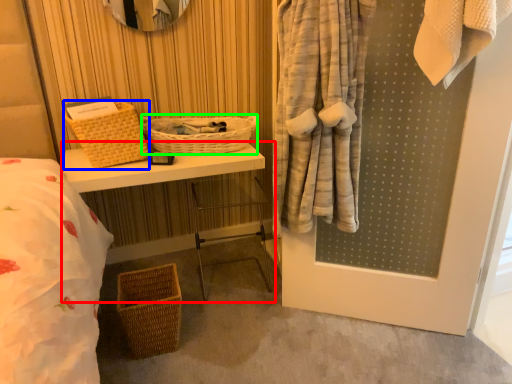
Question: Considering the real-world distances, which object is farthest from table (highlighted by a red box)? basket (highlighted by a blue box) or basket (highlighted by a green box)?

Choices:
 (A) basket
 (B) basket

Answer: (B)